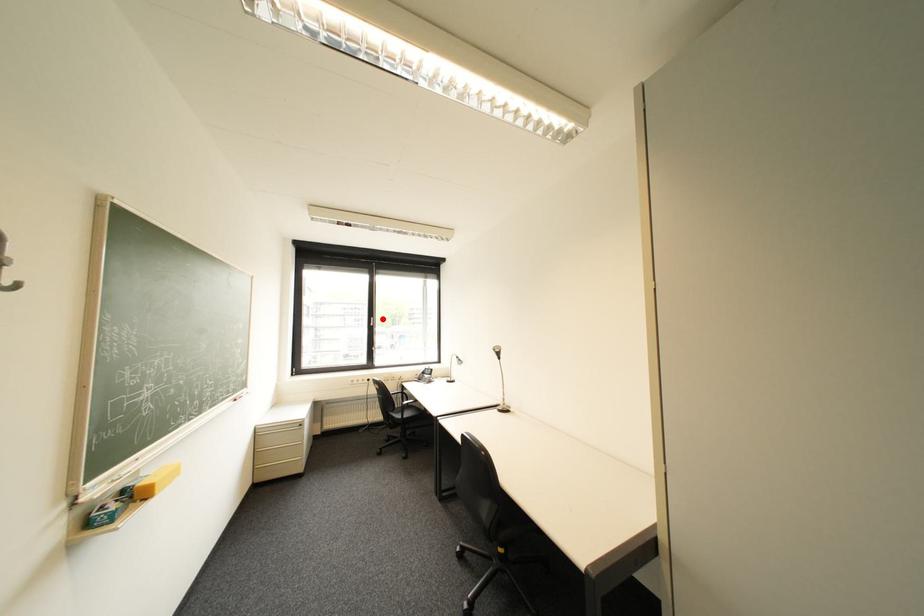
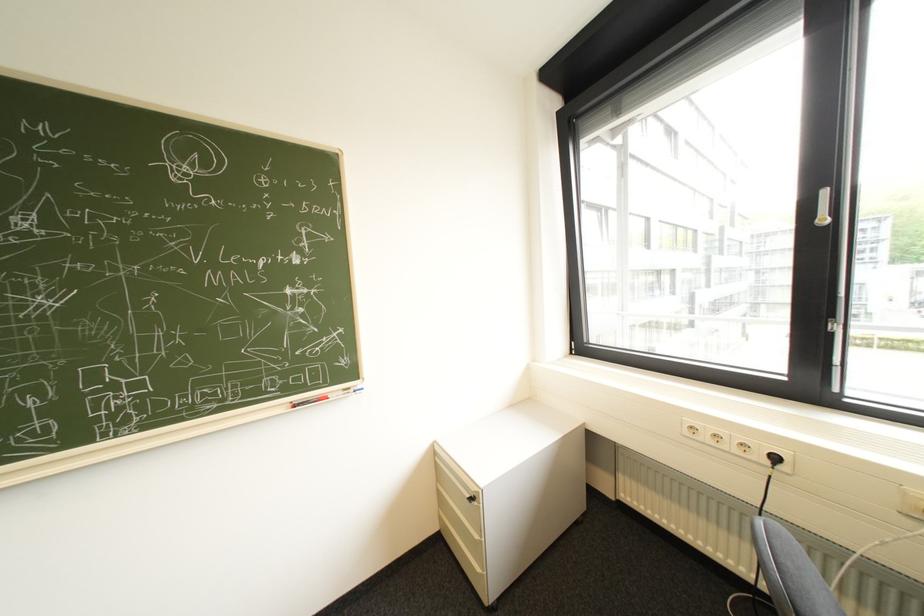
The point at the highlighted location is marked in the first image. Where is the corresponding point in the second image?

(834, 193)